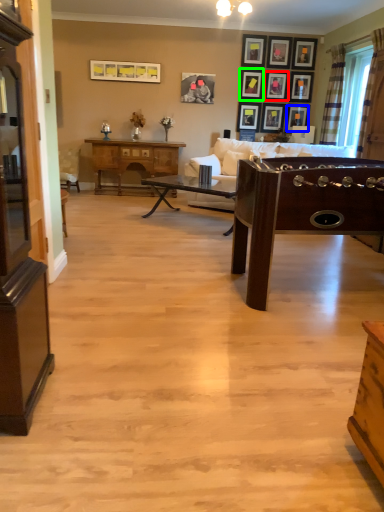
Question: Estimate the real-world distances between objects in this image. Which object is closer to picture frame (highlighted by a red box), picture frame (highlighted by a blue box) or picture frame (highlighted by a green box)?

Choices:
 (A) picture frame
 (B) picture frame

Answer: (B)